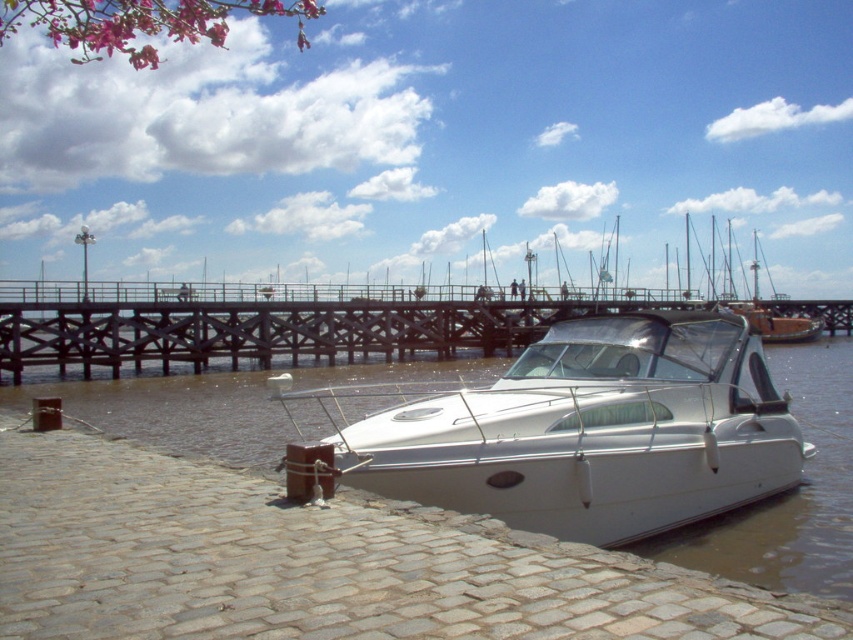
You are a photographer planning to capture the white glossy water at center and the white glossy dock at center in a single frame. Given that your camera has a fixed focal length, which object should you position closer to the center of the frame to ensure both are fully visible?

Since the white glossy water at center is narrower than the white glossy dock at center, you should position the white glossy dock at center closer to the center of the frame to ensure both fit within the camera view.

You are standing on the wooden pier and want to board the white glossy boat at center. Which direction should you move relative to the white glossy dock at center?

You should move downward relative to the white glossy dock at center to reach the white glossy boat at center since the boat is located below the dock.